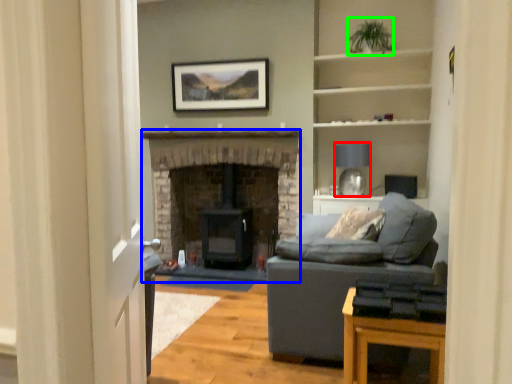
Question: Estimate the real-world distances between objects in this image. Which object is closer to lamp (highlighted by a red box), fireplace (highlighted by a blue box) or plant (highlighted by a green box)?

Choices:
 (A) fireplace
 (B) plant

Answer: (A)